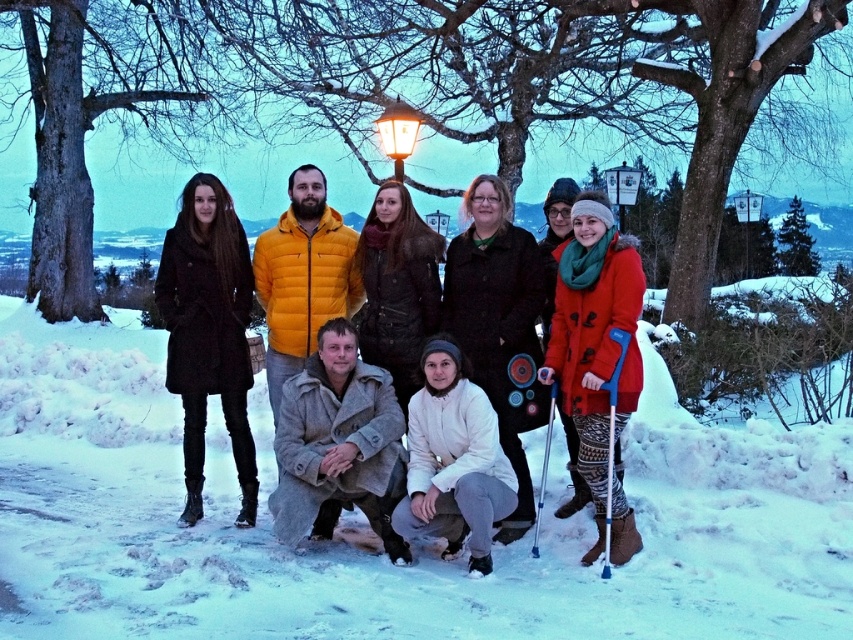
You are a photographer trying to capture a clear photo of the orange fuzzy coat at right and the blue metallic crutches at lower right. Since the camera can only focus on one object at a time, which object should you choose to ensure it appears sharp and in focus, considering their sizes?

The orange fuzzy coat at right has a larger size compared to blue metallic crutches at lower right, so you should focus on the orange fuzzy coat at right to ensure it appears sharp and in focus.